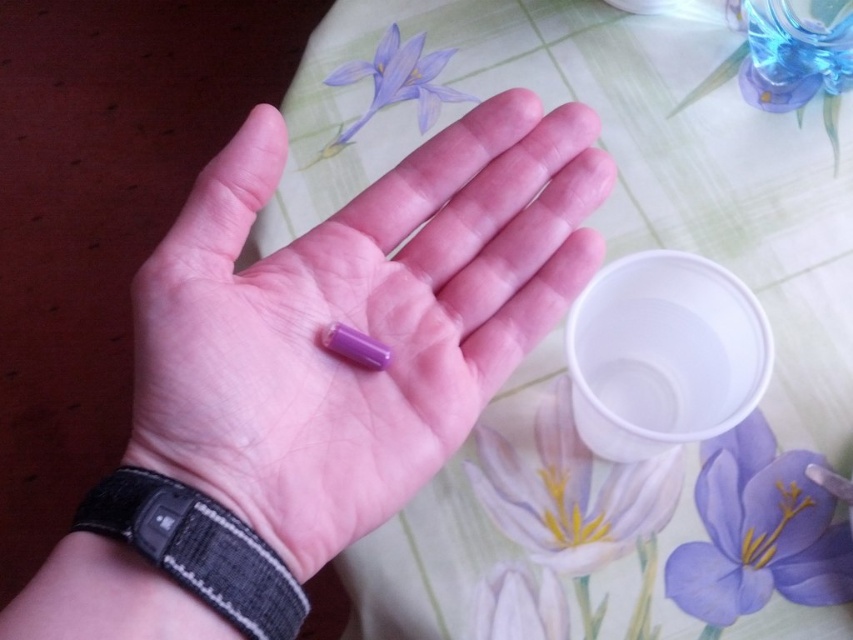
You are a delivery robot that needs to deliver a package to a point located at coordinates point [483,52]. The package must be placed exactly at that point. Given that the robot has a maximum reach of 70 centimeters, can the robot place the package at the required point without moving closer?

The distance between point [483,52] and the camera is 73.79 centimeters. Since the robot can only reach up to 70 centimeters, it cannot place the package at the required point without moving closer.

You are a robotic arm trying to pick up the purple capsule pill. The robotic arm can only move in straight lines and must avoid any obstacles. Given the coordinates of the floral pattern at center as point (561, 324), where should the robotic arm move to first to safely reach the pill?

The robotic arm should first move towards the floral pattern at center located at point (561, 324) to ensure a clear path to the pill by avoiding obstacles around it.

You are a nurse checking the medication setup for a patient. You see the white glossy cup at lower center and the purple matte flower at lower center. Which object is closer to you in the scene?

The white glossy cup at lower center is closer to you than the purple matte flower at lower center.